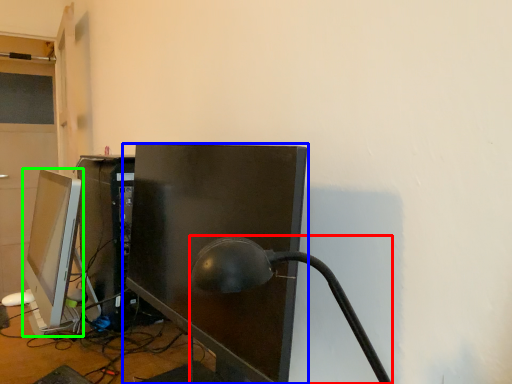
Question: Which object is positioned closest to table lamp (highlighted by a red box)? Select from computer monitor (highlighted by a blue box) and computer monitor (highlighted by a green box).

Choices:
 (A) computer monitor
 (B) computer monitor

Answer: (A)